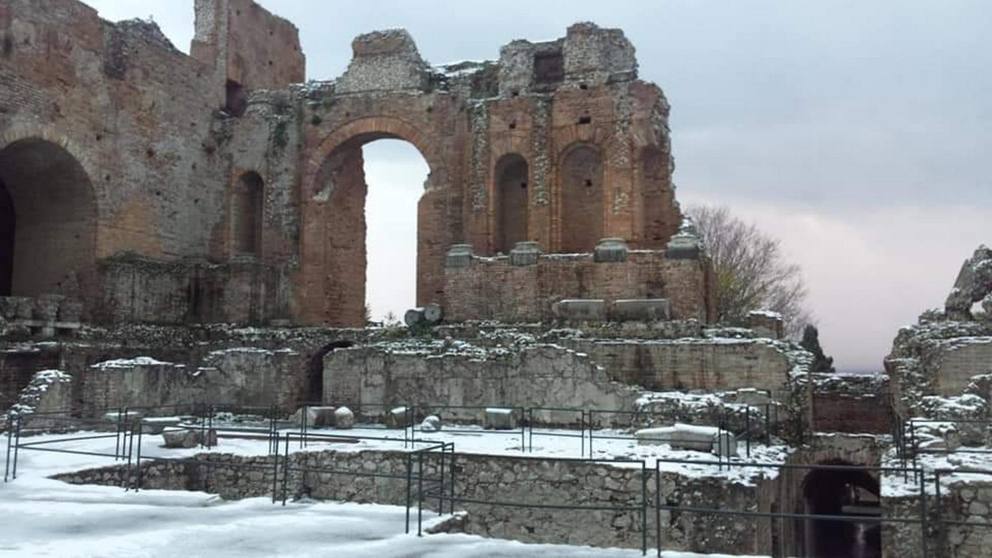
At what (x,y) coordinates should I click in order to perform the action: click on crumbling wall. Please return your answer as a coordinate pair (x, y). The height and width of the screenshot is (558, 992). Looking at the image, I should click on coord(434,376).